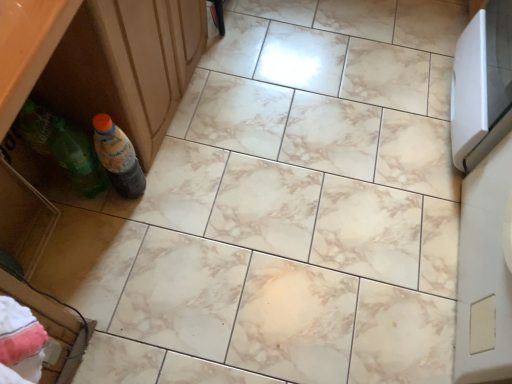
Question: Should I look upward or downward to see green plastic drawer at lower left?

Choices:
 (A) up
 (B) down

Answer: (B)

Question: From the image's perspective, is translucent plastic bottle at lower left on top of green plastic drawer at lower left?

Choices:
 (A) yes
 (B) no

Answer: (A)

Question: Is green plastic drawer at lower left completely or partially inside translucent plastic bottle at lower left?

Choices:
 (A) yes
 (B) no

Answer: (B)

Question: Is translucent plastic bottle at lower left turned away from green plastic drawer at lower left?

Choices:
 (A) no
 (B) yes

Answer: (A)

Question: Is translucent plastic bottle at lower left taller than green plastic drawer at lower left?

Choices:
 (A) no
 (B) yes

Answer: (A)

Question: From a real-world perspective, is translucent plastic bottle at lower left on green plastic drawer at lower left?

Choices:
 (A) no
 (B) yes

Answer: (A)

Question: Is translucent plastic bottle at lower left closer to the viewer compared to green plastic drawer at lower left?

Choices:
 (A) no
 (B) yes

Answer: (A)

Question: From the image's perspective, does green plastic drawer at lower left appear higher than translucent plastic bottle at lower left?

Choices:
 (A) no
 (B) yes

Answer: (A)

Question: Is green plastic drawer at lower left turned away from translucent plastic bottle at lower left?

Choices:
 (A) no
 (B) yes

Answer: (A)

Question: From the image's perspective, is green plastic drawer at lower left located beneath translucent plastic bottle at lower left?

Choices:
 (A) no
 (B) yes

Answer: (B)

Question: Considering the relative sizes of green plastic drawer at lower left and translucent plastic bottle at lower left in the image provided, is green plastic drawer at lower left smaller than translucent plastic bottle at lower left?

Choices:
 (A) no
 (B) yes

Answer: (A)

Question: Is the surface of green plastic drawer at lower left in direct contact with translucent plastic bottle at lower left?

Choices:
 (A) yes
 (B) no

Answer: (B)

Question: Does green plastic drawer at lower left have a greater width compared to translucent plastic bottle at lower left?

Choices:
 (A) yes
 (B) no

Answer: (A)

Question: Considering the positions of green plastic drawer at lower left and translucent plastic bottle at lower left in the image, is green plastic drawer at lower left taller or shorter than translucent plastic bottle at lower left?

Choices:
 (A) tall
 (B) short

Answer: (A)